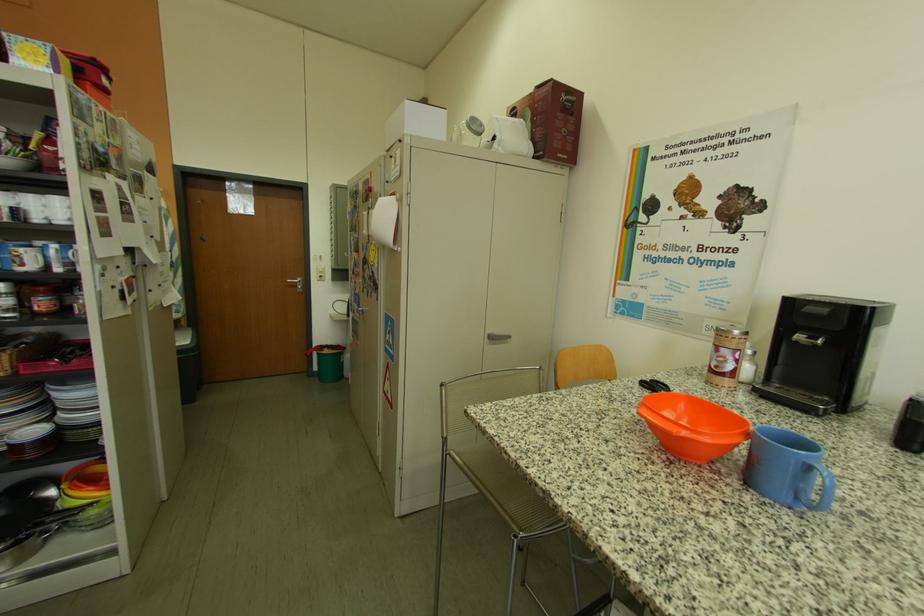
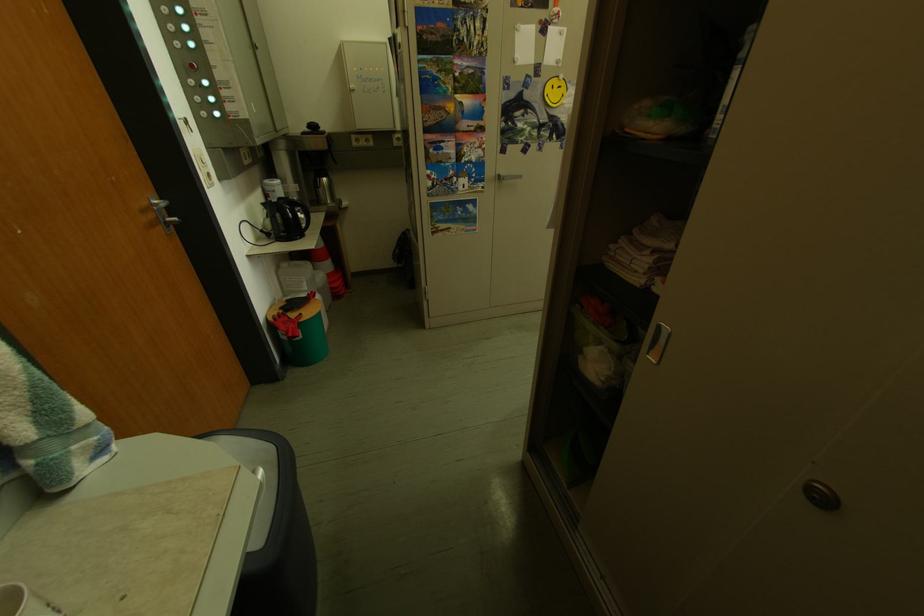
Find the pixel in the second image that matches the point at 381,246 in the first image.

(546, 82)